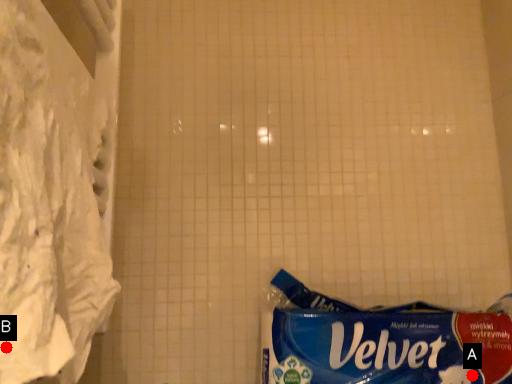
Question: Two points are circled on the image, labeled by A and B beside each circle. Which point appears closest to the camera in this image?

Choices:
 (A) A is closer
 (B) B is closer

Answer: (B)